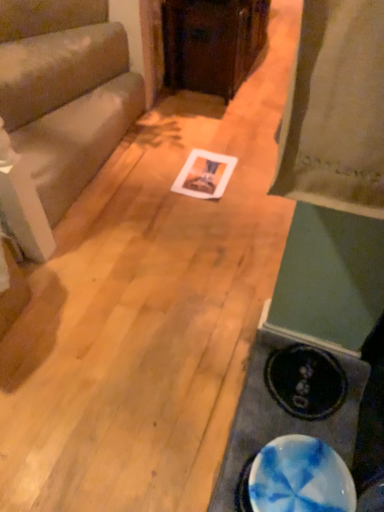
Image resolution: width=384 pixels, height=512 pixels. I want to click on free space to the left of blue marble table at lower right, so click(x=154, y=412).